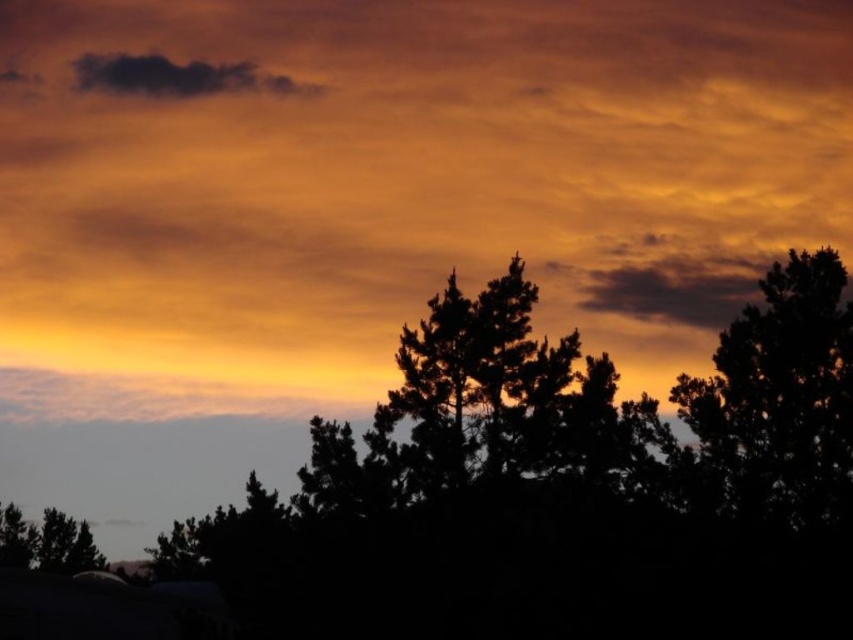
Is silhouette tree at right to the left of dark gray cloud at upper left from the viewer's perspective?

In fact, silhouette tree at right is to the right of dark gray cloud at upper left.

Is point (741, 451) farther from viewer compared to point (146, 77)?

No, (741, 451) is in front of (146, 77).

This screenshot has height=640, width=853. In order to click on silhouette tree at right in this screenshot , I will do `click(782, 397)`.